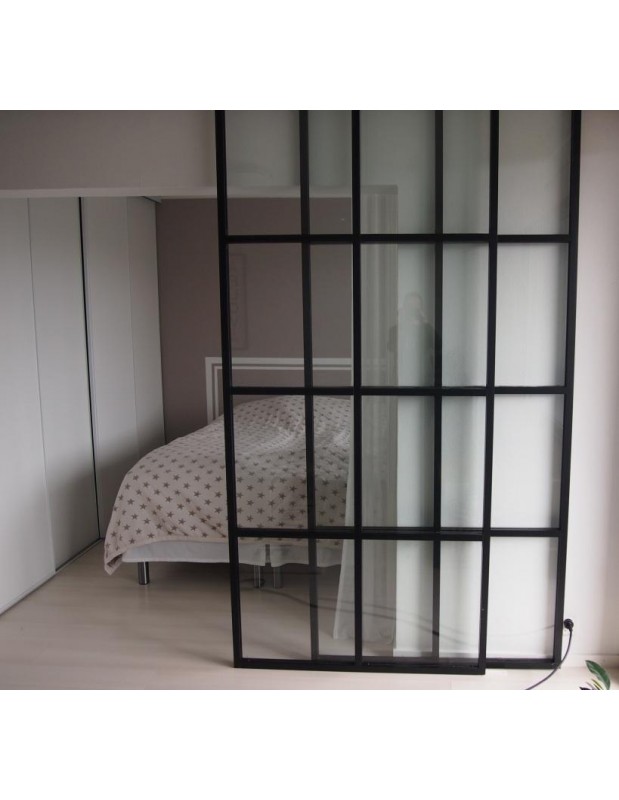
You are a GUI agent. You are given a task and a screenshot of the screen. Output one action in this format:
    pyautogui.click(x=<x>, y=<y>)
    Task: Click on the wall
    The image size is (619, 800).
    Given the screenshot: What is the action you would take?
    pyautogui.click(x=599, y=490)